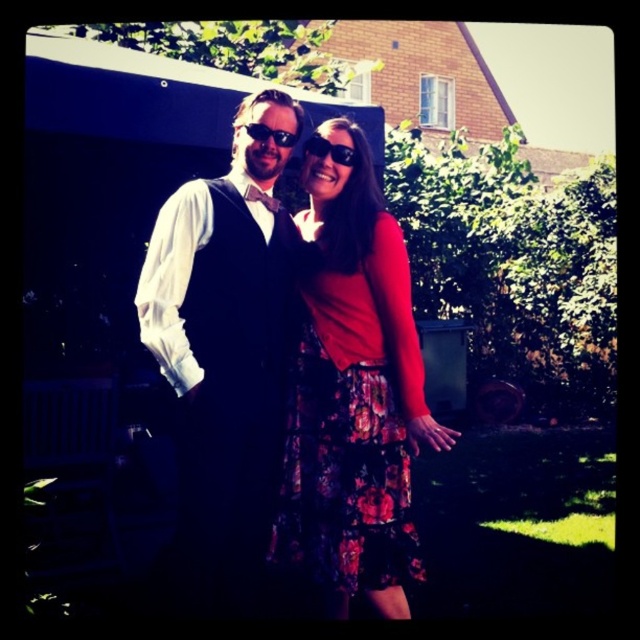
Question: Which of these objects is positioned closest to the floral skirt at center?

Choices:
 (A) matte black vest at center
 (B) sunglasses at center

Answer: (A)

Question: Does matte black vest at center appear over black plastic sunglasses at center?

Choices:
 (A) yes
 (B) no

Answer: (B)

Question: Can you confirm if floral skirt at center is positioned above black plastic sunglasses at center?

Choices:
 (A) no
 (B) yes

Answer: (A)

Question: Which object is closer to the camera taking this photo?

Choices:
 (A) floral skirt at center
 (B) black plastic sunglasses at center
 (C) matte black vest at center
 (D) sunglasses at center

Answer: (C)

Question: Which of these objects is positioned closest to the black plastic sunglasses at center?

Choices:
 (A) sunglasses at center
 (B) floral skirt at center

Answer: (A)

Question: Can you confirm if sunglasses at center is positioned above black plastic sunglasses at center?

Choices:
 (A) no
 (B) yes

Answer: (A)